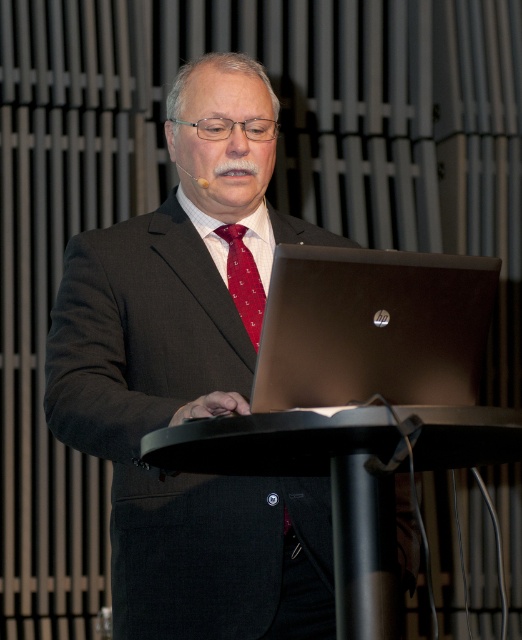
Question: Which of the following is the closest to the observer?

Choices:
 (A) (205, 124)
 (B) (263, 296)

Answer: (A)

Question: Among these objects, which one is nearest to the camera?

Choices:
 (A) black plastic podium at center
 (B) matte black suit at center
 (C) silky red tie at center

Answer: (A)

Question: Is satin black laptop at center smaller than silky red tie at center?

Choices:
 (A) no
 (B) yes

Answer: (A)

Question: From the image, what is the correct spatial relationship of satin black laptop at center in relation to black plastic podium at center?

Choices:
 (A) left
 (B) right

Answer: (B)

Question: Which point is farther to the camera?

Choices:
 (A) satin black laptop at center
 (B) silky red tie at center

Answer: (B)

Question: Does satin black laptop at center have a greater width compared to black plastic podium at center?

Choices:
 (A) yes
 (B) no

Answer: (B)